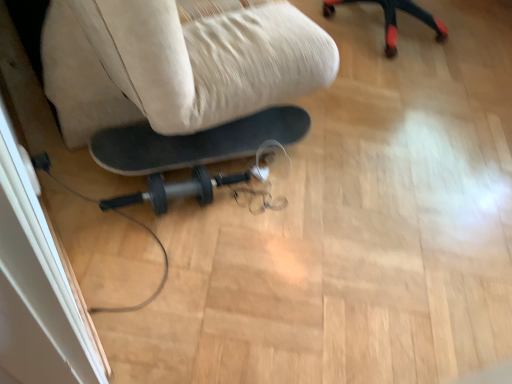
Question: Would you say transparent plastic screen door at lower left is to the left or to the right of beige fabric swivel chair at center in the picture?

Choices:
 (A) right
 (B) left

Answer: (B)

Question: From the image's perspective, is transparent plastic screen door at lower left located above or below beige fabric swivel chair at center?

Choices:
 (A) above
 (B) below

Answer: (B)

Question: Considering the positions of transparent plastic screen door at lower left and beige fabric swivel chair at center in the image, is transparent plastic screen door at lower left taller or shorter than beige fabric swivel chair at center?

Choices:
 (A) short
 (B) tall

Answer: (A)

Question: In terms of size, does beige fabric swivel chair at center appear bigger or smaller than transparent plastic screen door at lower left?

Choices:
 (A) big
 (B) small

Answer: (A)

Question: Is beige fabric swivel chair at center taller or shorter than transparent plastic screen door at lower left?

Choices:
 (A) tall
 (B) short

Answer: (A)

Question: Is point (256, 94) closer or farther from the camera than point (16, 175)?

Choices:
 (A) closer
 (B) farther

Answer: (B)

Question: Visually, is beige fabric swivel chair at center positioned to the left or to the right of transparent plastic screen door at lower left?

Choices:
 (A) left
 (B) right

Answer: (B)